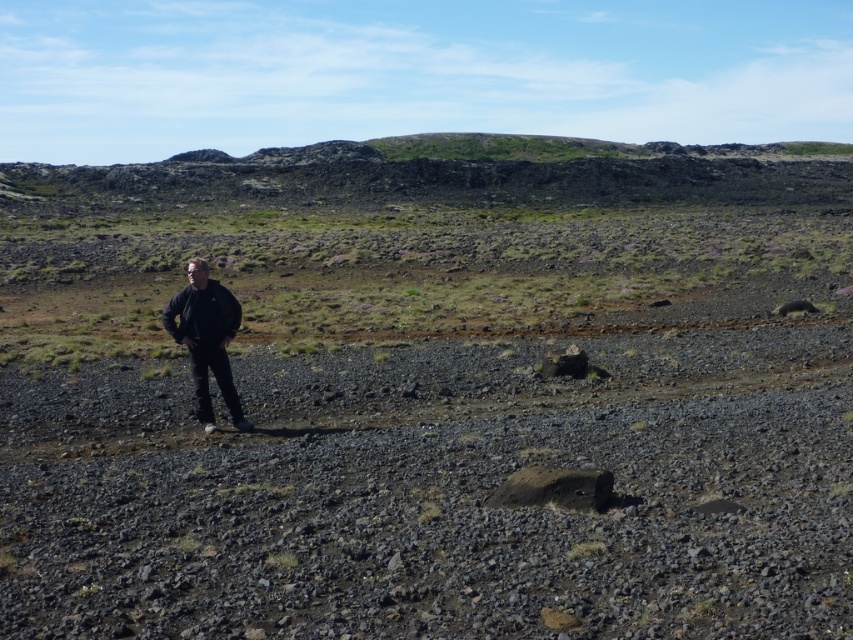
You are a hiker navigating through this rugged landscape. You notice the black matte jacket at center and the smooth gray rock at center. Which object is closer to you as you stand on the rocky ground?

The black matte jacket at center is closer to you because it is positioned in front of the smooth gray rock at center.

You are an explorer in this rugged landscape and need to decide whether your black matte jacket at center can be placed over the smooth gray rock at center without hanging off the edges. Can you do this?

The black matte jacket at center is wider than the smooth gray rock at center, so placing it over the rock would cause parts of the jacket to hang off the edges.